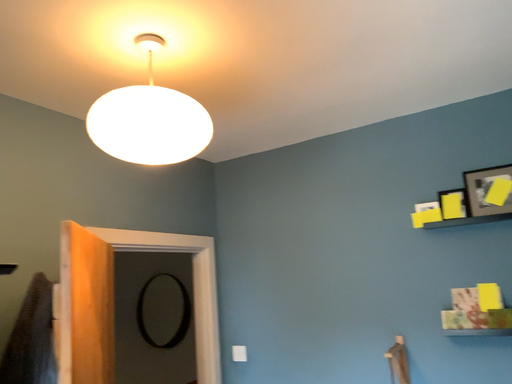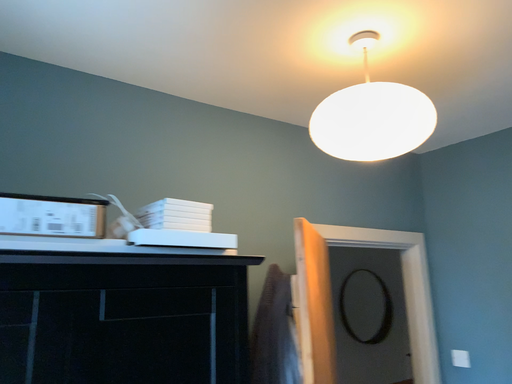
Question: How did the camera likely rotate when shooting the video?

Choices:
 (A) rotated left
 (B) rotated right

Answer: (A)